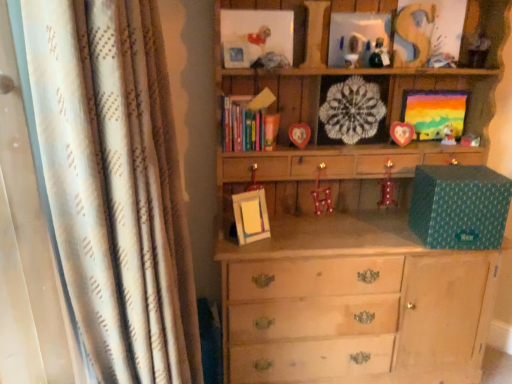
Question: Considering their positions, is metallic silver picture frame at upper center, the first picture frame from the left, located in front of or behind matte wooden picture frame at upper center, which appears as the sixth picture frame when viewed from the left?

Choices:
 (A) front
 (B) behind

Answer: (A)

Question: Based on their sizes in the image, would you say metallic silver picture frame at upper center, which appears as the eighth picture frame when viewed from the right, is bigger or smaller than matte wooden picture frame at upper center, which appears as the sixth picture frame when viewed from the left?

Choices:
 (A) big
 (B) small

Answer: (B)

Question: Considering the real-world distances, which object is closest to the matte plastic toy at upper center, which is the 2th toy from top to bottom?

Choices:
 (A) matte white figurine at upper right, acting as the 2th toy starting from the bottom
 (B) matte wooden picture frame at upper center, which appears as the sixth picture frame when viewed from the left
 (C) matte plastic picture frame at upper center, which is the 6th picture frame in right-to-left order
 (D) glossy plastic toy at upper center, which is counted as the 4th toy, starting from the right
 (E) light wood chest of drawers at center

Answer: (B)

Question: Which object is positioned farthest from the light wood chest of drawers at center?

Choices:
 (A) glossy plastic toy at upper center, positioned as the third toy in bottom-to-top order
 (B) matte plastic toy at upper center, which is the first toy in left-to-right order
 (C) hardcover books at center
 (D) yellow matte picture frame at center, which is the 2th picture frame in left-to-right order
 (E) matte white figurine at upper right, which is the 3th toy from right to left

Answer: (A)